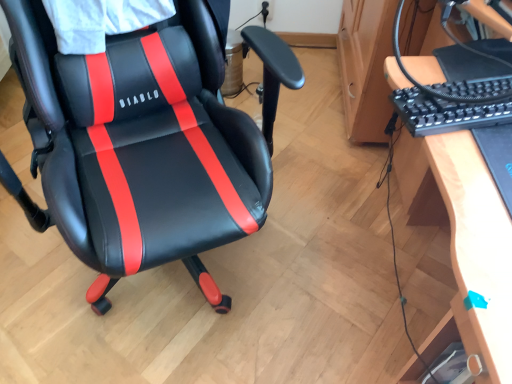
Question: From a real-world perspective, is wooden desk at right below black leather chair at center?

Choices:
 (A) no
 (B) yes

Answer: (A)

Question: Is wooden desk at right not within black leather chair at center?

Choices:
 (A) no
 (B) yes

Answer: (B)

Question: Considering the relative positions of wooden desk at right and black leather chair at center in the image provided, is wooden desk at right behind black leather chair at center?

Choices:
 (A) no
 (B) yes

Answer: (A)

Question: From the image's perspective, is wooden desk at right beneath black leather chair at center?

Choices:
 (A) yes
 (B) no

Answer: (A)

Question: Can you confirm if wooden desk at right is wider than black leather chair at center?

Choices:
 (A) no
 (B) yes

Answer: (A)

Question: From the image's perspective, is wooden desk at right above or below black plastic keyboard at right?

Choices:
 (A) below
 (B) above

Answer: (A)

Question: Considering the positions of wooden desk at right and black plastic keyboard at right in the image, is wooden desk at right bigger or smaller than black plastic keyboard at right?

Choices:
 (A) big
 (B) small

Answer: (A)

Question: In terms of width, does wooden desk at right look wider or thinner when compared to black plastic keyboard at right?

Choices:
 (A) thin
 (B) wide

Answer: (A)

Question: Considering the positions of wooden desk at right and black plastic keyboard at right in the image, is wooden desk at right taller or shorter than black plastic keyboard at right?

Choices:
 (A) short
 (B) tall

Answer: (B)

Question: Is wooden desk at right inside or outside of black leather chair at center?

Choices:
 (A) inside
 (B) outside

Answer: (B)

Question: Relative to black leather chair at center, is wooden desk at right in front or behind?

Choices:
 (A) behind
 (B) front

Answer: (B)

Question: From a real-world perspective, is wooden desk at right physically located above or below black leather chair at center?

Choices:
 (A) below
 (B) above

Answer: (B)

Question: Is wooden desk at right bigger or smaller than black leather chair at center?

Choices:
 (A) big
 (B) small

Answer: (B)

Question: From the image's perspective, is black plastic keyboard at right located above or below wooden desk at right?

Choices:
 (A) above
 (B) below

Answer: (A)

Question: Considering the positions of black plastic keyboard at right and wooden desk at right in the image, is black plastic keyboard at right bigger or smaller than wooden desk at right?

Choices:
 (A) big
 (B) small

Answer: (B)